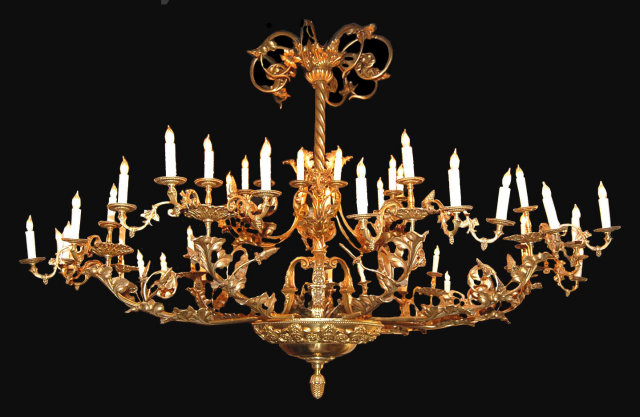
Where is `rod through center of chandelier`? This screenshot has height=417, width=640. rod through center of chandelier is located at coordinates (319, 128).